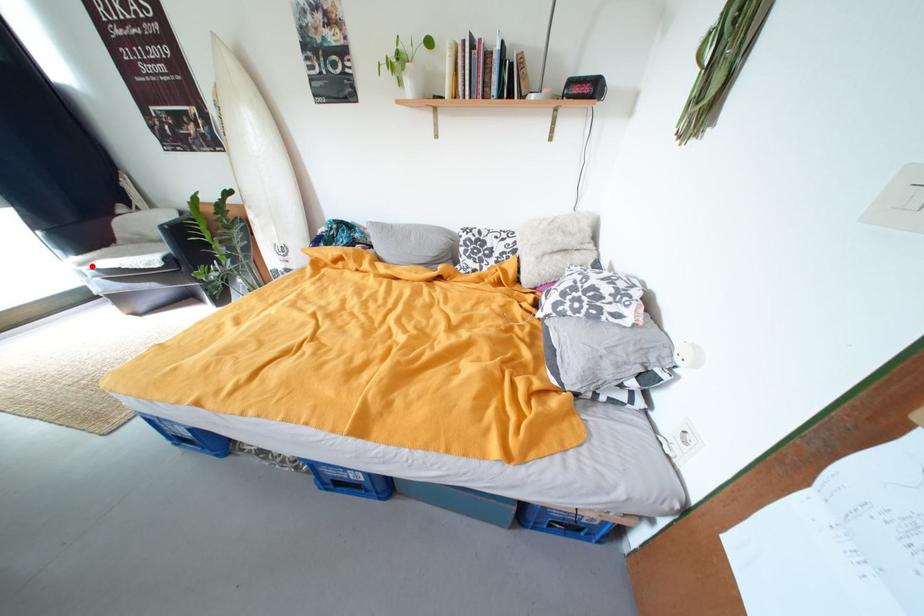
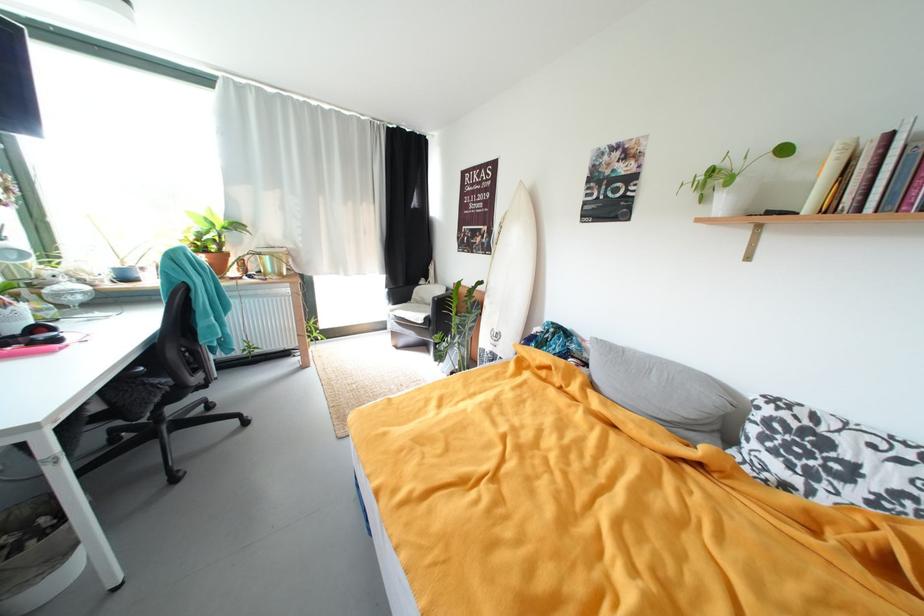
Question: I am providing you with two images of the same scene from different viewpoints. Image1 has a red point marked. In image2, the corresponding 3D location appears at what relative position? Reply with the corresponding letter.

Choices:
 (A) Closer
 (B) Farther

Answer: (A)